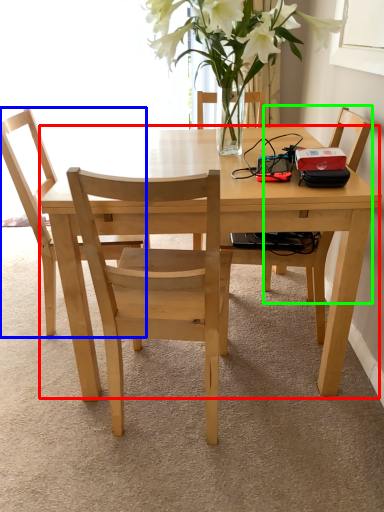
Question: Estimate the real-world distances between objects in this image. Which object is closer to kitchen & dining room table (highlighted by a red box), chair (highlighted by a blue box) or chair (highlighted by a green box)?

Choices:
 (A) chair
 (B) chair

Answer: (A)